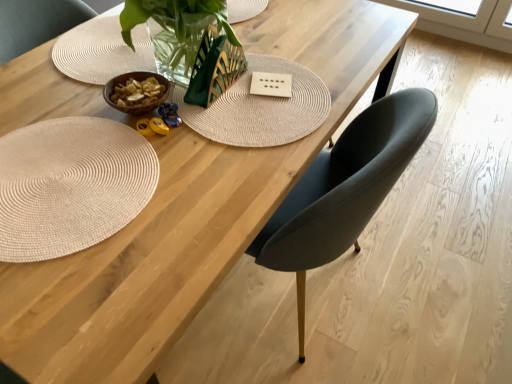
Question: Is white matte card at center bigger than natural woven mat at lower left?

Choices:
 (A) no
 (B) yes

Answer: (A)

Question: Is white matte card at center not inside natural woven mat at lower left?

Choices:
 (A) no
 (B) yes

Answer: (B)

Question: Considering the relative positions of white matte card at center and natural woven mat at lower left in the image provided, is white matte card at center to the left of natural woven mat at lower left from the viewer's perspective?

Choices:
 (A) yes
 (B) no

Answer: (B)

Question: Considering the relative sizes of white matte card at center and natural woven mat at lower left in the image provided, is white matte card at center thinner than natural woven mat at lower left?

Choices:
 (A) no
 (B) yes

Answer: (B)

Question: Considering the relative positions of white matte card at center and natural woven mat at lower left in the image provided, is white matte card at center to the right of natural woven mat at lower left from the viewer's perspective?

Choices:
 (A) yes
 (B) no

Answer: (A)

Question: Would you consider white matte card at center to be distant from natural woven mat at lower left?

Choices:
 (A) no
 (B) yes

Answer: (A)

Question: Considering the relative sizes of natural woven mat at lower left and white matte card at center in the image provided, is natural woven mat at lower left wider than white matte card at center?

Choices:
 (A) no
 (B) yes

Answer: (B)

Question: From a real-world perspective, is natural woven mat at lower left on white matte card at center?

Choices:
 (A) yes
 (B) no

Answer: (A)

Question: From the image's perspective, would you say natural woven mat at lower left is positioned over white matte card at center?

Choices:
 (A) no
 (B) yes

Answer: (A)

Question: From the image's perspective, is natural woven mat at lower left below white matte card at center?

Choices:
 (A) no
 (B) yes

Answer: (B)

Question: Does natural woven mat at lower left have a greater height compared to white matte card at center?

Choices:
 (A) yes
 (B) no

Answer: (A)

Question: From a real-world perspective, is natural woven mat at lower left beneath white matte card at center?

Choices:
 (A) yes
 (B) no

Answer: (B)

Question: Is natural woven mat at lower left wider or thinner than white matte card at center?

Choices:
 (A) thin
 (B) wide

Answer: (B)